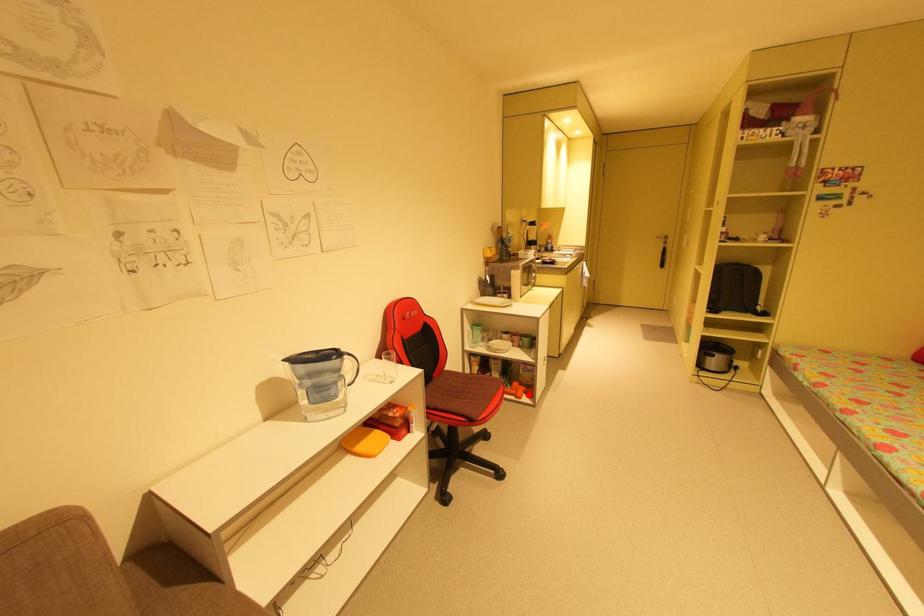
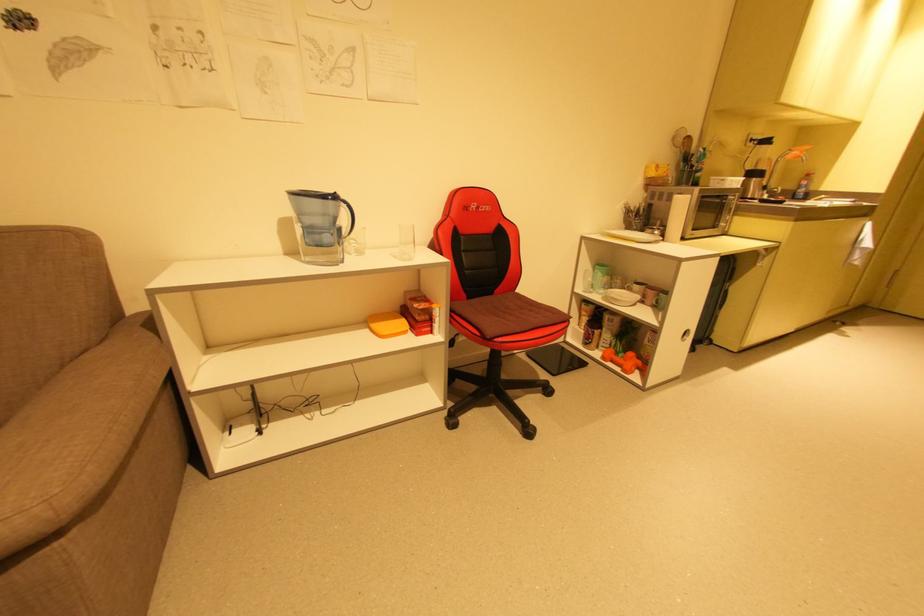
Question: I am providing you with two images of the same scene from different viewpoints. In image1, a red point is highlighted. Considering the same 3D point in image2, which of the following is correct?

Choices:
 (A) It is closer
 (B) It is farther

Answer: (A)